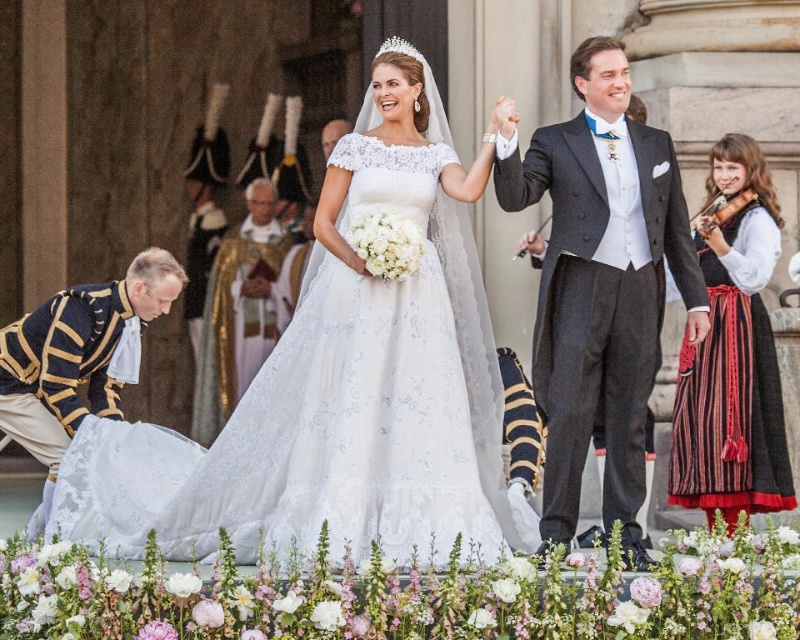
Question: In this image, where is lace fabric wedding dress at center located relative to matte black suit at upper right?

Choices:
 (A) above
 (B) below

Answer: (B)

Question: Which object is closer to the camera taking this photo?

Choices:
 (A) clear crystal tiara at upper center
 (B) striped cotton dress at right

Answer: (A)

Question: Does striped cotton dress at right appear over clear crystal tiara at upper center?

Choices:
 (A) yes
 (B) no

Answer: (B)

Question: Can you confirm if matte black suit at upper right is positioned above clear crystal tiara at upper center?

Choices:
 (A) no
 (B) yes

Answer: (A)

Question: Among these objects, which one is farthest from the camera?

Choices:
 (A) matte black suit at upper right
 (B) clear crystal tiara at upper center

Answer: (B)

Question: Which point is closer to the camera?

Choices:
 (A) matte black suit at upper right
 (B) clear crystal tiara at upper center

Answer: (A)